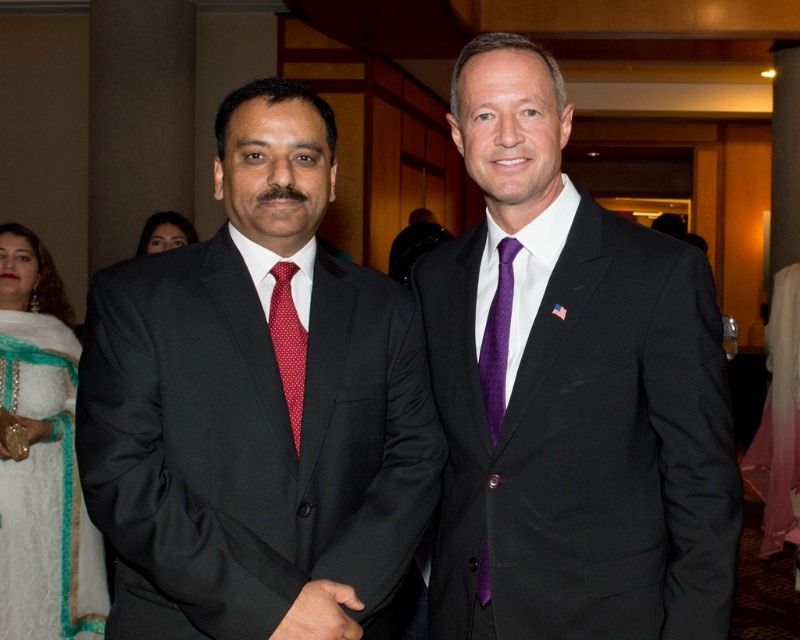
Is purple satin suit at center shorter than red dotted fabric tie at left?

In fact, purple satin suit at center may be taller than red dotted fabric tie at left.

Which is more to the left, purple satin suit at center or red dotted fabric tie at left?

red dotted fabric tie at left

This screenshot has width=800, height=640. I want to click on purple satin suit at center, so click(x=572, y=394).

Can you confirm if purple satin suit at center is positioned to the left of purple textured tie at center?

In fact, purple satin suit at center is to the right of purple textured tie at center.

Describe the element at coordinates (572, 394) in the screenshot. I see `purple satin suit at center` at that location.

Find the location of `purple satin suit at center`. purple satin suit at center is located at coordinates (572, 394).

Is matte black suit at center to the right of purple textured tie at center from the viewer's perspective?

In fact, matte black suit at center is to the left of purple textured tie at center.

From the picture: Can you confirm if matte black suit at center is taller than purple textured tie at center?

Yes, matte black suit at center is taller than purple textured tie at center.

I want to click on matte black suit at center, so click(x=256, y=410).